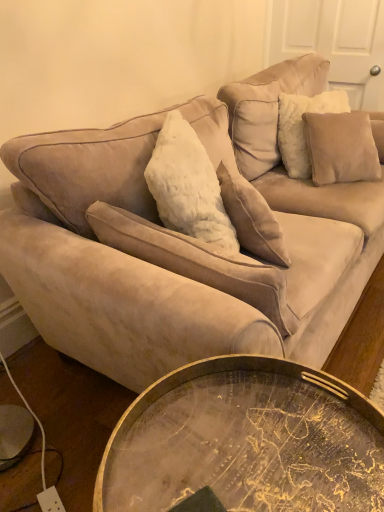
Question: Can you confirm if suede beige couch at upper center is positioned to the left of suede beige pillow at upper right, placed as the 1th pillow when sorted from right to left?

Choices:
 (A) no
 (B) yes

Answer: (B)

Question: Is suede beige couch at upper center to the right of suede beige pillow at upper right, which appears as the 3th pillow when viewed from the front, from the viewer's perspective?

Choices:
 (A) yes
 (B) no

Answer: (B)

Question: Is suede beige couch at upper center outside suede beige pillow at upper right, placed as the 1th pillow when sorted from right to left?

Choices:
 (A) yes
 (B) no

Answer: (A)

Question: Would you say suede beige couch at upper center contains suede beige pillow at upper right, which is the first pillow from back to front?

Choices:
 (A) yes
 (B) no

Answer: (A)

Question: Is suede beige couch at upper center wider than suede beige pillow at upper right, which is the 3th pillow from left to right?

Choices:
 (A) no
 (B) yes

Answer: (B)

Question: From the image's perspective, is suede beige couch at upper center under suede beige pillow at upper right, placed as the 1th pillow when sorted from right to left?

Choices:
 (A) yes
 (B) no

Answer: (A)

Question: Is suede beige couch at upper center positioned in front of white fluffy pillow at center, which is counted as the 3th pillow, starting from the right?

Choices:
 (A) yes
 (B) no

Answer: (A)

Question: Is white fluffy pillow at center, marked as the 1th pillow in a front-to-back arrangement, inside suede beige couch at upper center?

Choices:
 (A) no
 (B) yes

Answer: (B)

Question: Is suede beige couch at upper center smaller than white fluffy pillow at center, acting as the 1th pillow starting from the left?

Choices:
 (A) no
 (B) yes

Answer: (A)

Question: Is suede beige couch at upper center wider than white fluffy pillow at center, which is counted as the 3th pillow, starting from the right?

Choices:
 (A) no
 (B) yes

Answer: (B)

Question: Considering the relative sizes of suede beige couch at upper center and white fluffy pillow at center, which is counted as the 3th pillow, starting from the right, in the image provided, is suede beige couch at upper center bigger than white fluffy pillow at center, which is counted as the 3th pillow, starting from the right,?

Choices:
 (A) no
 (B) yes

Answer: (B)

Question: From a real-world perspective, does suede beige couch at upper center stand above white fluffy pillow at center, acting as the 1th pillow starting from the left?

Choices:
 (A) no
 (B) yes

Answer: (A)

Question: Is gold metallic tray at lower center at the left side of suede beige pillow at upper right, the second pillow from the right?

Choices:
 (A) no
 (B) yes

Answer: (B)